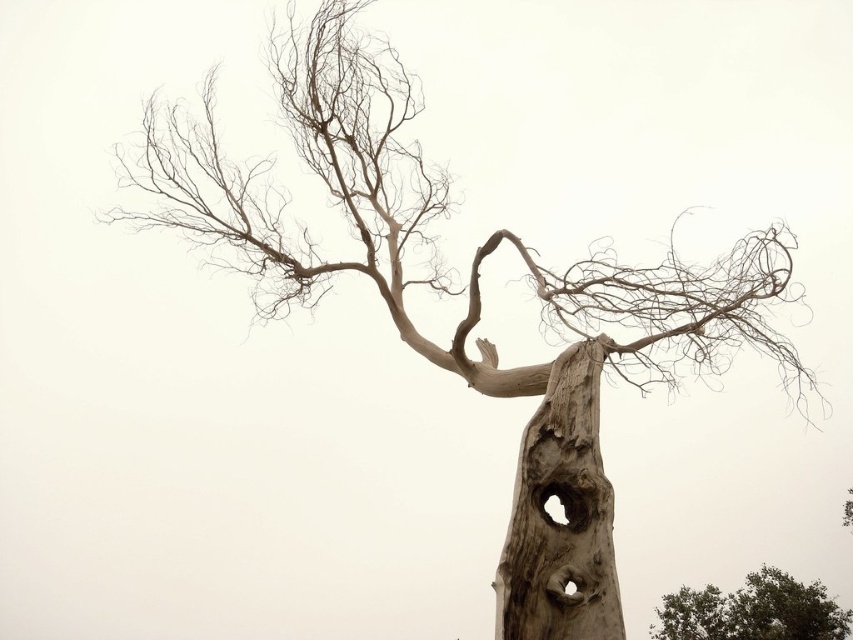
You are standing in a forest and want to take a photo of both the gray rough bark tree trunk at center and the green leafy tree at lower right. Which tree should you focus on first to ensure both are in sharp focus?

You should focus on the gray rough bark tree trunk at center first because it is closer to you than the green leafy tree at lower right. By focusing on the closer object, the background tree will still be in acceptable focus due to the depth of field, ensuring both are sharp.

You are an environmental scientist assessing the health of two trees in a forest. You observe the gray rough bark tree trunk at center and the green leafy tree at lower right. Which tree is positioned to the right side of the other?

The gray rough bark tree trunk at center is to the left of green leafy tree at lower right, so the green leafy tree at lower right is positioned to the right side of the gray rough bark tree trunk at center.

You are standing in front of the gray rough bark tree trunk at center. What are the coordinates of its position in the image?

The gray rough bark tree trunk at center is located at coordinates point (x=563, y=516).